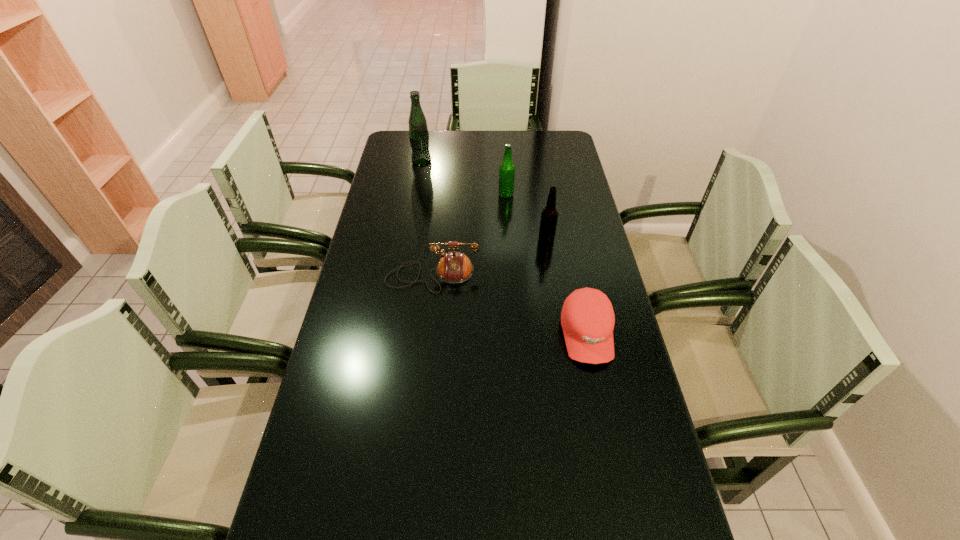
Find the location of a particular element. This screenshot has height=540, width=960. object positioned at the far left corner is located at coordinates (418, 131).

What are the coordinates of `vacant space at the far edge of the desktop` in the screenshot? It's located at (451, 143).

In the image, there is a desktop. Where is `vacant space at the left edge`? The width and height of the screenshot is (960, 540). vacant space at the left edge is located at coordinates (369, 311).

At what (x,y) coordinates should I click in order to perform the action: click on blank area at the right edge. Please return your answer as a coordinate pair (x, y). The width and height of the screenshot is (960, 540). Looking at the image, I should click on point(564,257).

At what (x,y) coordinates should I click in order to perform the action: click on vacant space at the far left corner of the desktop. Please return your answer as a coordinate pair (x, y). Looking at the image, I should click on (397, 132).

Image resolution: width=960 pixels, height=540 pixels. In the image, there is a desktop. What are the coordinates of `free space at the far right corner` in the screenshot? It's located at (564, 143).

This screenshot has width=960, height=540. I want to click on free space between the third nearest object and the second farthest object, so click(x=526, y=217).

Find the location of a particular element. This screenshot has width=960, height=540. free space between the leftmost beer bottle and the third farthest object is located at coordinates (484, 201).

Where is `empty space that is in between the telephone and the leftmost beer bottle`? This screenshot has height=540, width=960. empty space that is in between the telephone and the leftmost beer bottle is located at coordinates (427, 219).

Where is `vacant area that lies between the second farthest object and the nearest object`? vacant area that lies between the second farthest object and the nearest object is located at coordinates (546, 265).